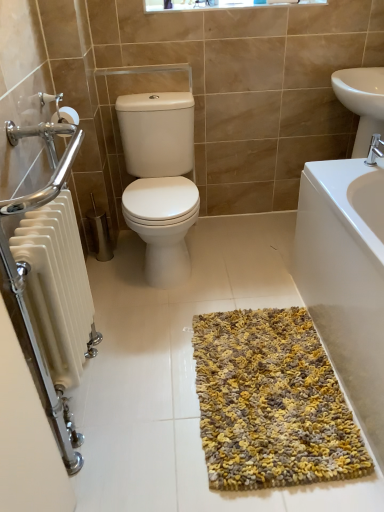
Question: Is silver metallic faucet at upper right to the left of yellow textured bath mat at lower right from the viewer's perspective?

Choices:
 (A) yes
 (B) no

Answer: (A)

Question: Is silver metallic faucet at upper right shorter than yellow textured bath mat at lower right?

Choices:
 (A) yes
 (B) no

Answer: (A)

Question: Is silver metallic faucet at upper right completely or partially outside of yellow textured bath mat at lower right?

Choices:
 (A) yes
 (B) no

Answer: (A)

Question: From the image's perspective, is silver metallic faucet at upper right over yellow textured bath mat at lower right?

Choices:
 (A) no
 (B) yes

Answer: (B)

Question: Can you confirm if silver metallic faucet at upper right is thinner than yellow textured bath mat at lower right?

Choices:
 (A) no
 (B) yes

Answer: (B)

Question: Is white glossy toilet at center bigger or smaller than white plastic window frame at upper center?

Choices:
 (A) small
 (B) big

Answer: (B)

Question: Visually, is white glossy toilet at center positioned to the left or to the right of white plastic window frame at upper center?

Choices:
 (A) right
 (B) left

Answer: (B)

Question: In terms of width, does white glossy toilet at center look wider or thinner when compared to white plastic window frame at upper center?

Choices:
 (A) thin
 (B) wide

Answer: (B)

Question: Is point (190, 203) positioned closer to the camera than point (238, 5)?

Choices:
 (A) farther
 (B) closer

Answer: (B)

Question: Which is correct: white glossy toilet at center is inside yellow-grey shaggy rug at center, or outside of it?

Choices:
 (A) outside
 (B) inside

Answer: (A)

Question: Does point (157, 100) appear closer or farther from the camera than point (208, 438)?

Choices:
 (A) farther
 (B) closer

Answer: (A)

Question: Is white glossy toilet at center to the left or to the right of yellow-grey shaggy rug at center in the image?

Choices:
 (A) right
 (B) left

Answer: (B)

Question: In terms of height, does white glossy toilet at center look taller or shorter compared to yellow-grey shaggy rug at center?

Choices:
 (A) short
 (B) tall

Answer: (B)

Question: Considering the positions of yellow textured bath mat at lower right and silver metallic faucet at upper right in the image, is yellow textured bath mat at lower right taller or shorter than silver metallic faucet at upper right?

Choices:
 (A) short
 (B) tall

Answer: (B)

Question: Looking at their shapes, would you say yellow textured bath mat at lower right is wider or thinner than silver metallic faucet at upper right?

Choices:
 (A) thin
 (B) wide

Answer: (B)